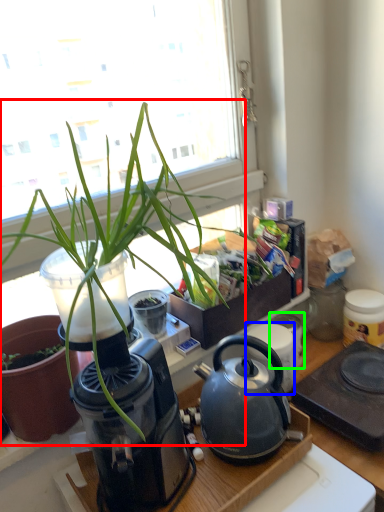
Question: Considering the real-world distances, which object is closest to houseplant (highlighted by a red box)? appliance (highlighted by a blue box) or appliance (highlighted by a green box).

Choices:
 (A) appliance
 (B) appliance

Answer: (A)